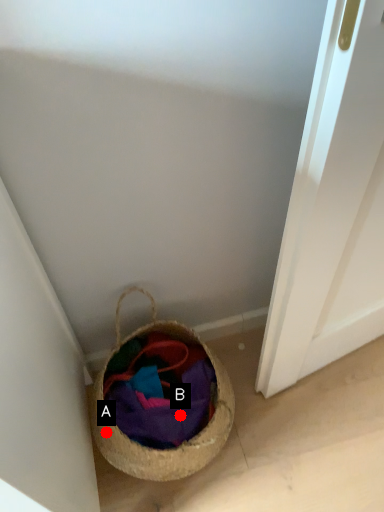
Question: Two points are circled on the image, labeled by A and B beside each circle. Among these points, which one is nearest to the camera?

Choices:
 (A) A is closer
 (B) B is closer

Answer: (A)